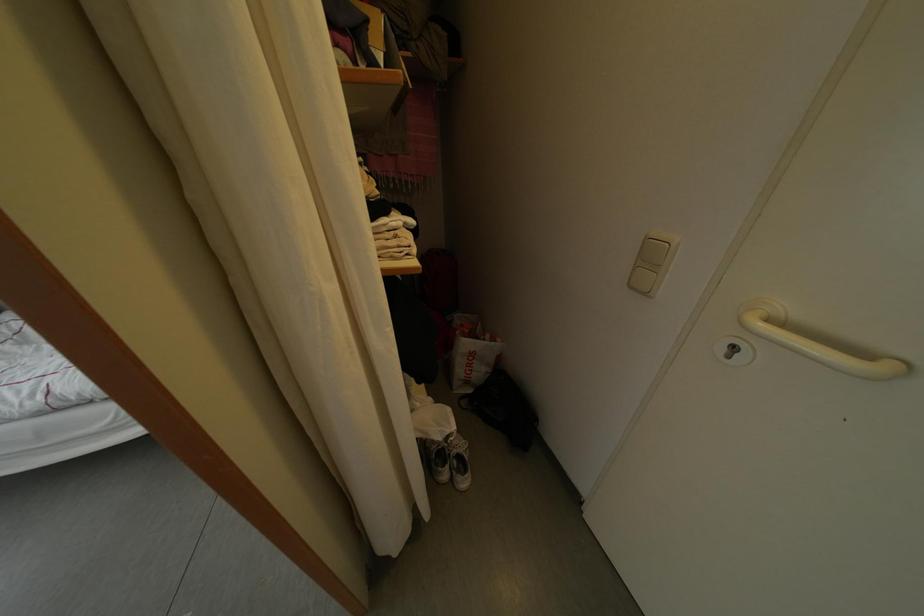
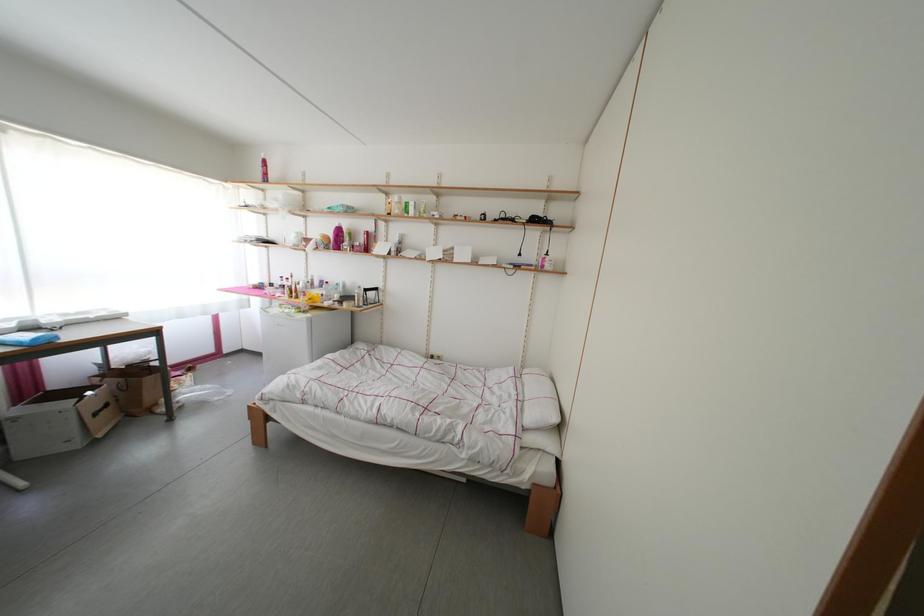
The first image is from the beginning of the video and the second image is from the end. How did the camera likely rotate when shooting the video?

The camera's rotation is toward left-up.